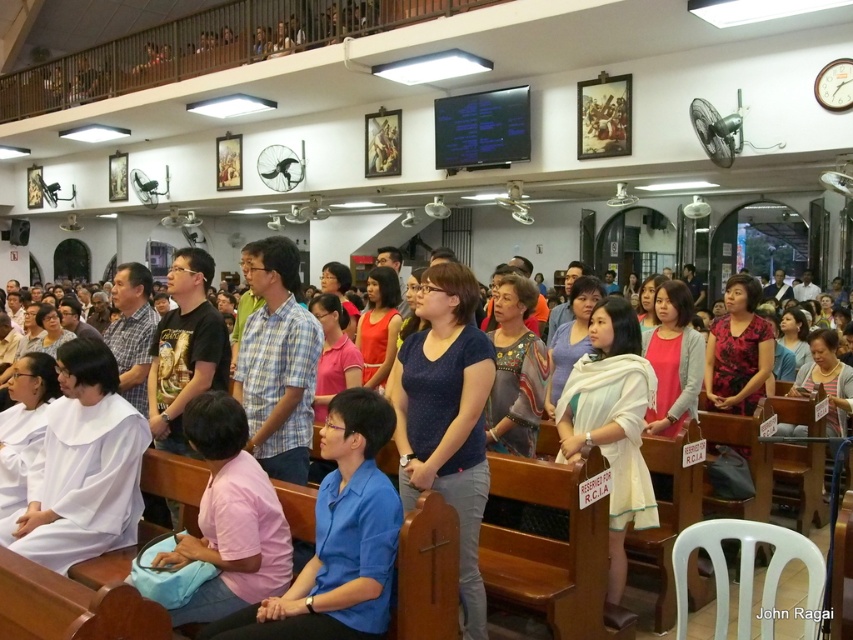
Question: Which point is closer to the camera?

Choices:
 (A) (173, 486)
 (B) (381, 576)

Answer: (B)

Question: Is blue smooth shirt at lower center closer to the viewer compared to blue fabric shirt at center?

Choices:
 (A) no
 (B) yes

Answer: (A)

Question: Can you confirm if blue smooth shirt at lower center is positioned below blue fabric shirt at center?

Choices:
 (A) no
 (B) yes

Answer: (A)

Question: Can you confirm if blue smooth shirt at lower center is positioned below blue fabric shirt at center?

Choices:
 (A) no
 (B) yes

Answer: (A)

Question: Which of the following is the closest to the observer?

Choices:
 (A) blue fabric shirt at center
 (B) blue smooth shirt at lower center

Answer: (A)